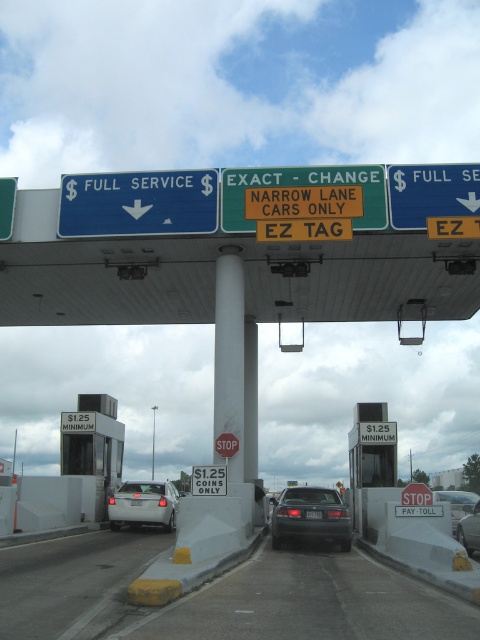
You are driving a large truck and notice the white rectangular sign at center and the white plastic license plate at center in your lane. Based on the scene description, can you safely pass through this lane?

The white rectangular sign at center is above the white plastic license plate at center. Since the lane has a sign stating NARROW LANE CARS ONLY, your large truck may not fit safely in this lane. Please choose a different lane designed for larger vehicles.

You are driving a large truck and notice the white rectangular sign at center and the white plastic license plate at center in your path. Which object is closer to your vehicle?

The white plastic license plate at center is behind the white rectangular sign at center, so the white rectangular sign at center is closer to your vehicle.

You are driving a car that is 1.8 meters wide and need to choose between the two lanes shown in the image. The lanes are labeled as either FULL SERVICE or EXACT CHANGE. The EXACT CHANGE lane has a sign stating NARROW LANE CARS ONLY. Given the dark gray matte sedan at center and the black glossy sedan at center, which car would you choose to follow to ensure your car fits safely in the lane?

The dark gray matte sedan at center has a smaller width than the black glossy sedan at center. Since the EXACT CHANGE lane is for narrow cars only, following the dark gray matte sedan at center ensures your 1.8 meter wide car fits safely in the lane.